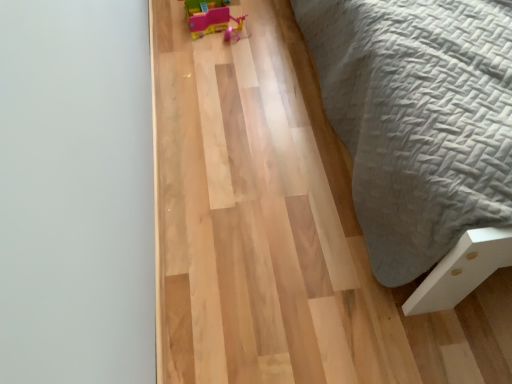
Question: Is pink plastic toy at upper center situated inside natural wood floor at center or outside?

Choices:
 (A) inside
 (B) outside

Answer: (B)

Question: Considering the relative positions of pink plastic toy at upper center and natural wood floor at center in the image provided, is pink plastic toy at upper center to the left or to the right of natural wood floor at center?

Choices:
 (A) right
 (B) left

Answer: (B)

Question: From a real-world perspective, is pink plastic toy at upper center above or below natural wood floor at center?

Choices:
 (A) below
 (B) above

Answer: (B)

Question: Is natural wood floor at center bigger or smaller than pink plastic toy at upper center?

Choices:
 (A) small
 (B) big

Answer: (B)

Question: Do you think natural wood floor at center is within pink plastic toy at upper center, or outside of it?

Choices:
 (A) inside
 (B) outside

Answer: (B)

Question: Looking at their shapes, would you say natural wood floor at center is wider or thinner than pink plastic toy at upper center?

Choices:
 (A) wide
 (B) thin

Answer: (A)

Question: Would you say natural wood floor at center is to the left or to the right of pink plastic toy at upper center in the picture?

Choices:
 (A) left
 (B) right

Answer: (B)